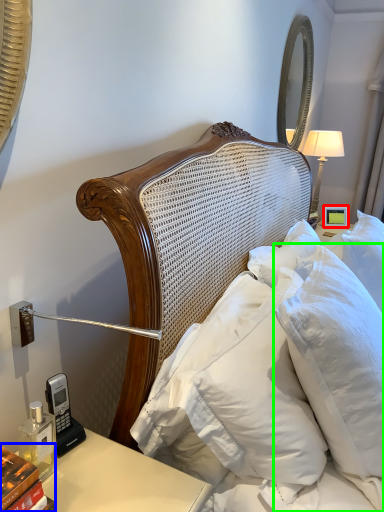
Question: Estimate the real-world distances between objects in this image. Which object is farther from picture frame (highlighted by a red box), book (highlighted by a blue box) or pillow (highlighted by a green box)?

Choices:
 (A) book
 (B) pillow

Answer: (A)